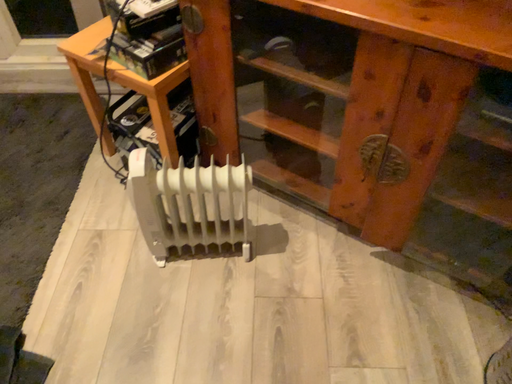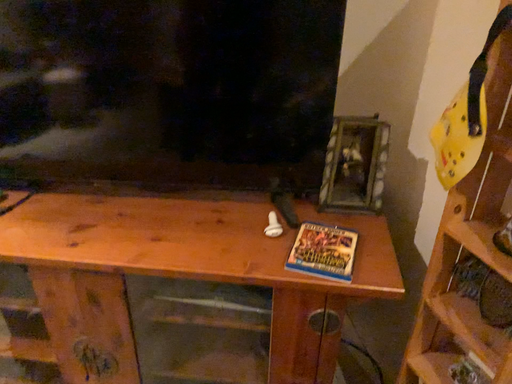
Question: How did the camera likely rotate when shooting the video?

Choices:
 (A) rotated left
 (B) rotated right

Answer: (B)